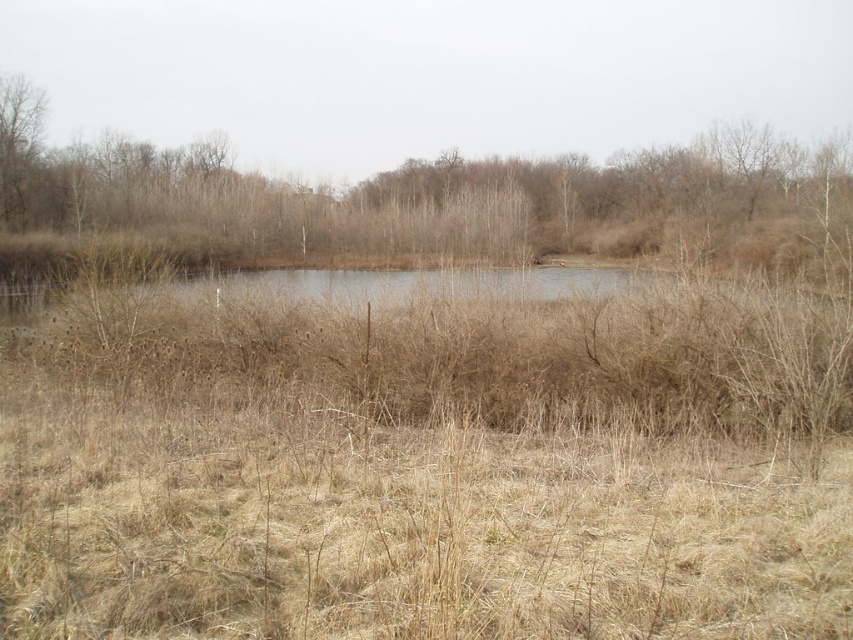
Question: Does brown dry grass at center come in front of bare branches at left?

Choices:
 (A) no
 (B) yes

Answer: (B)

Question: Can you confirm if brown dry grass at center is wider than bare branches at left?

Choices:
 (A) no
 (B) yes

Answer: (B)

Question: Which of the following is the farthest from the observer?

Choices:
 (A) (9, 145)
 (B) (347, 230)

Answer: (B)

Question: Does brown dry grass at center appear under bare branches at left?

Choices:
 (A) yes
 (B) no

Answer: (A)